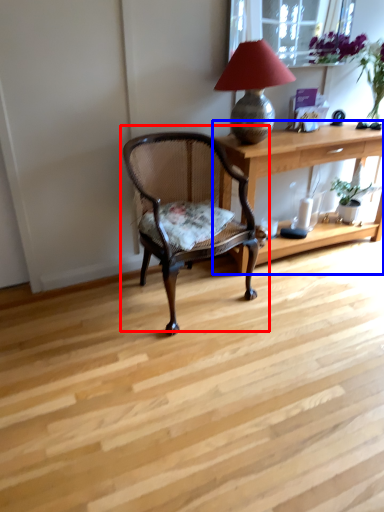
Question: Which object is further to the camera taking this photo, chair (highlighted by a red box) or desk (highlighted by a blue box)?

Choices:
 (A) chair
 (B) desk

Answer: (B)